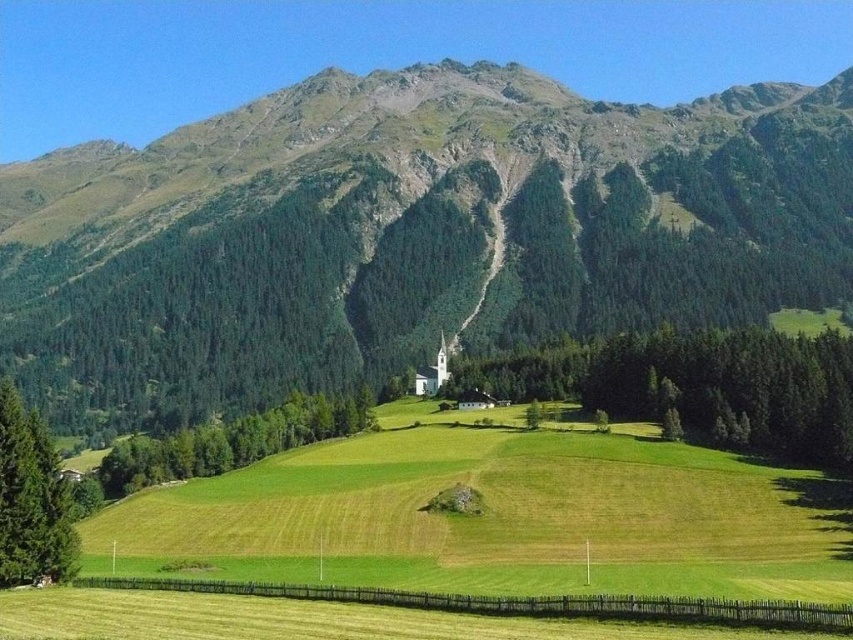
You are standing at the wooden fence in the scene and want to walk to the green grassy mountain at center and the green grassy field at center. Which one is wider from your perspective?

The green grassy mountain at center might be wider than the green grassy field at center, so the mountain appears wider from your perspective.

You are standing at the wooden fence in the scene and want to walk to the green grassy field at center. Which direction should you go relative to the green grassy mountain at center?

Since the green grassy mountain at center is closer to you than the green grassy field at center, you should walk away from the green grassy mountain at center to reach the green grassy field at center.